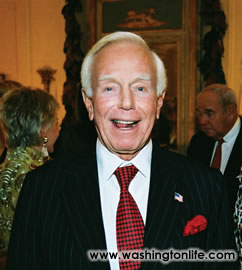
Where is `painting`? Image resolution: width=242 pixels, height=270 pixels. painting is located at coordinates (148, 17).